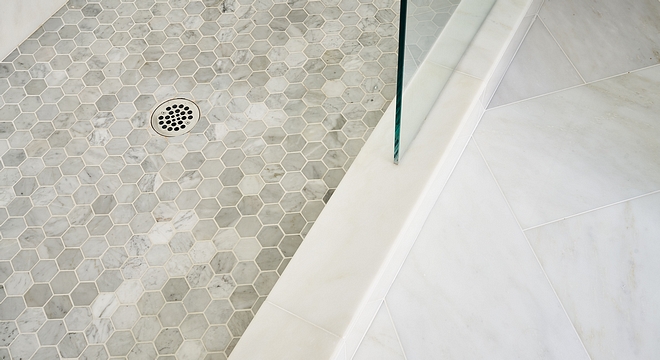
At what (x,y) coordinates should I click in order to perform the action: click on shower drain. Please return your answer as a coordinate pair (x, y). This screenshot has width=660, height=360. Looking at the image, I should click on (175, 121).